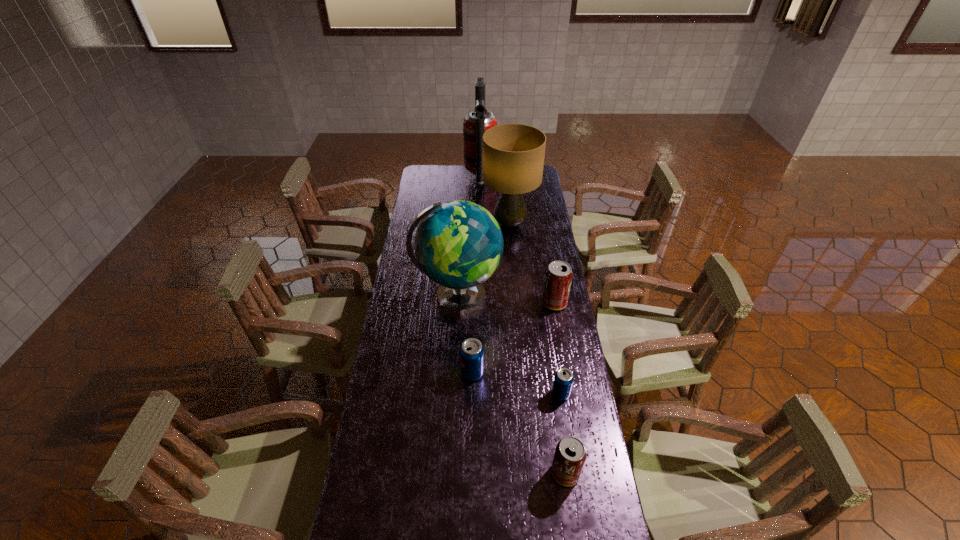
You are a GUI agent. You are given a task and a screenshot of the screen. Output one action in this format:
    pyautogui.click(x=<x>, y=<y>)
    Task: Click on the fire extinguisher
    The image size is (960, 540).
    Given the screenshot: What is the action you would take?
    pyautogui.click(x=478, y=121)

What are the coordinates of `red fire extinguisher` in the screenshot? It's located at (478, 121).

The image size is (960, 540). What are the coordinates of `the second farthest object` in the screenshot? It's located at (513, 154).

Identify the location of lampshade. This screenshot has width=960, height=540. (513, 154).

This screenshot has height=540, width=960. In order to click on blue globe in this screenshot , I will do `click(458, 244)`.

Where is `the farther red soda can`? Image resolution: width=960 pixels, height=540 pixels. the farther red soda can is located at coordinates (558, 276).

Find the location of a particular element. The image size is (960, 540). the fourth shortest object is located at coordinates (558, 276).

Locate an element on the screen. the bigger blue pop soda is located at coordinates (471, 351).

Find the location of a particular element. the left blue pop soda is located at coordinates point(471,351).

Where is `the nearest object`? This screenshot has width=960, height=540. the nearest object is located at coordinates (570, 455).